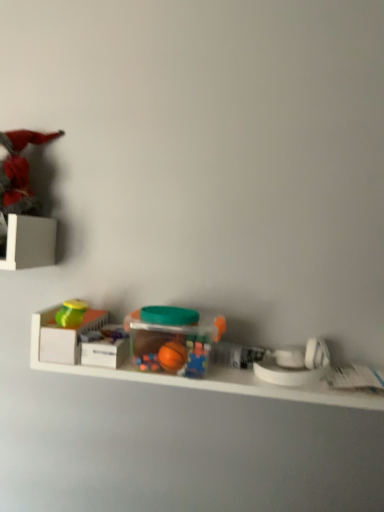
What is the approximate width of matte green lid at left, which appears as the 2th toy when viewed from the left?

It is 7.14 centimeters.

This screenshot has height=512, width=384. What do you see at coordinates (23, 206) in the screenshot?
I see `matte red flower at upper left, marked as the first toy in a left-to-right arrangement` at bounding box center [23, 206].

What is the approximate height of white plastic toy at right, placed as the fourth toy when sorted from left to right?

It is 3.27 inches.

Measure the distance between point (284,384) and camera.

Point (284,384) and camera are 33.19 inches apart from each other.

Locate an element on the screen. This screenshot has width=384, height=512. translucent plastic toys at center is located at coordinates (205, 378).

Which object is closer to the camera taking this photo, white matte storage box at left or matte green lid at left, which appears as the 2th toy when viewed from the left?

white matte storage box at left is in front.

Can you tell me how much white matte storage box at left and matte green lid at left, the third toy viewed from the right, differ in facing direction?

The facing directions of white matte storage box at left and matte green lid at left, the third toy viewed from the right, are 0.0913 degrees apart.

Based on the photo, considering the sizes of white matte storage box at left and matte green lid at left, the third toy viewed from the right, in the image, is white matte storage box at left taller or shorter than matte green lid at left, the third toy viewed from the right,?

white matte storage box at left is taller than matte green lid at left, the third toy viewed from the right.

Considering the relative sizes of white matte storage box at left and matte green lid at left, which appears as the 2th toy when viewed from the left, in the image provided, is white matte storage box at left bigger than matte green lid at left, which appears as the 2th toy when viewed from the left,?

Correct, white matte storage box at left is larger in size than matte green lid at left, which appears as the 2th toy when viewed from the left.

Which object is positioned more to the left, translucent plastic container at center, the 3th toy from the left, or white matte storage box at left?

From the viewer's perspective, white matte storage box at left appears more on the left side.

Is the position of translucent plastic container at center, the third toy in the top-to-bottom sequence, more distant than that of white matte storage box at left?

No, translucent plastic container at center, the third toy in the top-to-bottom sequence, is closer to the viewer.

Choose the correct answer: Is translucent plastic container at center, which is counted as the second toy, starting from the bottom, inside white matte storage box at left or outside it?

The correct answer is: outside.

Which is correct: white plastic toy at right, acting as the 4th toy starting from the top, is inside translucent plastic toys at center, or outside of it?

white plastic toy at right, acting as the 4th toy starting from the top, is spatially positioned inside translucent plastic toys at center.

Between white plastic toy at right, the first toy positioned from the right, and translucent plastic toys at center, which one has smaller size?

white plastic toy at right, the first toy positioned from the right, is smaller.

Does white matte storage box at left turn towards white plastic toy at right, acting as the 4th toy starting from the top?

No, white matte storage box at left is not facing towards white plastic toy at right, acting as the 4th toy starting from the top.

Does white matte storage box at left have a lesser height compared to white plastic toy at right, arranged as the first toy when ordered from the bottom?

Indeed, white matte storage box at left has a lesser height compared to white plastic toy at right, arranged as the first toy when ordered from the bottom.

From the image's perspective, which is above, white matte storage box at left or white plastic toy at right, the first toy positioned from the right?

white matte storage box at left, from the image's perspective.

Considering their positions, is white matte storage box at left located in front of or behind white plastic toy at right, acting as the 4th toy starting from the top?

white matte storage box at left is positioned farther from the viewer than white plastic toy at right, acting as the 4th toy starting from the top.

Find the location of `the 1st toy located above the translucent plastic container at center, the 3th toy from the left (from a real-world perspective)`. the 1st toy located above the translucent plastic container at center, the 3th toy from the left (from a real-world perspective) is located at coordinates (71, 313).

From the image's perspective, who appears lower, translucent plastic container at center, marked as the 2th toy in a right-to-left arrangement, or matte green lid at left, the third toy viewed from the right?

translucent plastic container at center, marked as the 2th toy in a right-to-left arrangement, is shown below in the image.

How far apart are translucent plastic container at center, which is counted as the second toy, starting from the bottom, and matte green lid at left, which appears as the 2th toy when viewed from the left?

translucent plastic container at center, which is counted as the second toy, starting from the bottom, and matte green lid at left, which appears as the 2th toy when viewed from the left, are 8.07 inches apart.

From the picture: Is translucent plastic container at center, marked as the 2th toy in a right-to-left arrangement, positioned far away from matte green lid at left, which appears as the 2th toy when viewed from the left?

Actually, translucent plastic container at center, marked as the 2th toy in a right-to-left arrangement, and matte green lid at left, which appears as the 2th toy when viewed from the left, are a little close together.

From a real-world perspective, is matte red flower at upper left, positioned as the 4th toy in bottom-to-top order, on translucent plastic toys at center?

Yes, from a real-world perspective, matte red flower at upper left, positioned as the 4th toy in bottom-to-top order, is over translucent plastic toys at center

From the image's perspective, is matte red flower at upper left, the 4th toy viewed from the right, located above translucent plastic toys at center?

Yes, from the image's perspective, matte red flower at upper left, the 4th toy viewed from the right, is over translucent plastic toys at center.

Could you measure the distance between matte red flower at upper left, the first toy when ordered from top to bottom, and translucent plastic toys at center?

They are 12.36 inches apart.

Considering the positions of objects matte red flower at upper left, positioned as the 4th toy in bottom-to-top order, and translucent plastic toys at center in the image provided, who is more to the right, matte red flower at upper left, positioned as the 4th toy in bottom-to-top order, or translucent plastic toys at center?

Positioned to the right is translucent plastic toys at center.

Does matte red flower at upper left, positioned as the 4th toy in bottom-to-top order, turn towards white plastic toy at right, arranged as the first toy when ordered from the bottom?

No.

In the image, is matte red flower at upper left, marked as the first toy in a left-to-right arrangement, positioned in front of or behind white plastic toy at right, the first toy positioned from the right?

Clearly, matte red flower at upper left, marked as the first toy in a left-to-right arrangement, is behind white plastic toy at right, the first toy positioned from the right.

From the image's perspective, is matte red flower at upper left, the first toy when ordered from top to bottom, above or below white plastic toy at right, acting as the 4th toy starting from the top?

Clearly, from the image's perspective, matte red flower at upper left, the first toy when ordered from top to bottom, is above white plastic toy at right, acting as the 4th toy starting from the top.

Which is behind, point (19, 131) or point (304, 371)?

The point (19, 131) is farther from the camera.

Which toy is the 1st one when counting from the right side of the white matte storage box at left? Please provide its 2D coordinates.

[(71, 313)]

Find the location of a particular element. The image size is (384, 512). the 1st toy positioned above the white matte storage box at left (from the image's perspective) is located at coordinates (172, 339).

Which object lies nearer to the anchor point translucent plastic container at center, the 3th toy from the left, matte red flower at upper left, marked as the first toy in a left-to-right arrangement, or white matte storage box at left?

white matte storage box at left lies closer to translucent plastic container at center, the 3th toy from the left, than the other object.

In the scene shown: Considering their positions, is white matte storage box at left positioned closer to white plastic toy at right, arranged as the first toy when ordered from the bottom, than translucent plastic container at center, marked as the 2th toy in a right-to-left arrangement?

The object closer to white plastic toy at right, arranged as the first toy when ordered from the bottom, is translucent plastic container at center, marked as the 2th toy in a right-to-left arrangement.

Based on their spatial positions, is translucent plastic toys at center or matte green lid at left, arranged as the 3th toy when ordered from the bottom, further from white matte storage box at left?

translucent plastic toys at center lies further to white matte storage box at left than the other object.

Based on their spatial positions, is translucent plastic container at center, marked as the 2th toy in a right-to-left arrangement, or matte green lid at left, the second toy from the top, further from white matte storage box at left?

translucent plastic container at center, marked as the 2th toy in a right-to-left arrangement.

Estimate the real-world distances between objects in this image. Which object is closer to white matte storage box at left, matte green lid at left, the second toy from the top, or translucent plastic toys at center?

matte green lid at left, the second toy from the top, is positioned closer to the anchor white matte storage box at left.

From the image, which object appears to be nearer to matte green lid at left, the second toy from the top, translucent plastic toys at center or translucent plastic container at center, which is counted as the second toy, starting from the bottom?

translucent plastic container at center, which is counted as the second toy, starting from the bottom, lies closer to matte green lid at left, the second toy from the top, than the other object.

Estimate the real-world distances between objects in this image. Which object is closer to matte green lid at left, arranged as the 3th toy when ordered from the bottom, translucent plastic container at center, marked as the 2th toy in a right-to-left arrangement, or white plastic toy at right, placed as the fourth toy when sorted from left to right?

Based on the image, translucent plastic container at center, marked as the 2th toy in a right-to-left arrangement, appears to be nearer to matte green lid at left, arranged as the 3th toy when ordered from the bottom.

Looking at the image, which one is located further to matte red flower at upper left, the first toy when ordered from top to bottom, white plastic toy at right, placed as the fourth toy when sorted from left to right, or translucent plastic container at center, marked as the 2th toy in a right-to-left arrangement?

white plastic toy at right, placed as the fourth toy when sorted from left to right.

This screenshot has height=512, width=384. I want to click on shelf between matte green lid at left, which appears as the 2th toy when viewed from the left, and white plastic toy at right, placed as the fourth toy when sorted from left to right, in the horizontal direction, so click(205, 378).

At what (x,y) coordinates should I click in order to perform the action: click on storage box situated between matte red flower at upper left, marked as the first toy in a left-to-right arrangement, and white plastic toy at right, acting as the 4th toy starting from the top, from left to right. Please return your answer as a coordinate pair (x, y). This screenshot has height=512, width=384. Looking at the image, I should click on (67, 338).

Locate an element on the screen. The image size is (384, 512). toy situated between matte red flower at upper left, positioned as the 4th toy in bottom-to-top order, and translucent plastic container at center, the 3th toy from the left, from left to right is located at coordinates (71, 313).

You are a GUI agent. You are given a task and a screenshot of the screen. Output one action in this format:
    pyautogui.click(x=<x>, y=<y>)
    Task: Click on the shelf between matte red flower at upper left, marked as the first toy in a left-to-right arrangement, and white plastic toy at right, acting as the 4th toy starting from the top
    The width and height of the screenshot is (384, 512).
    Given the screenshot: What is the action you would take?
    pos(205,378)